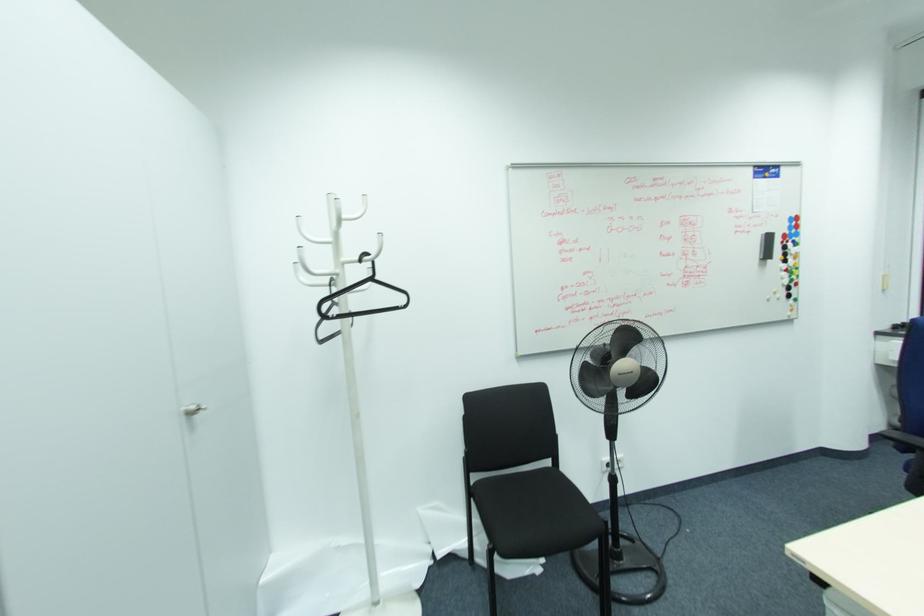
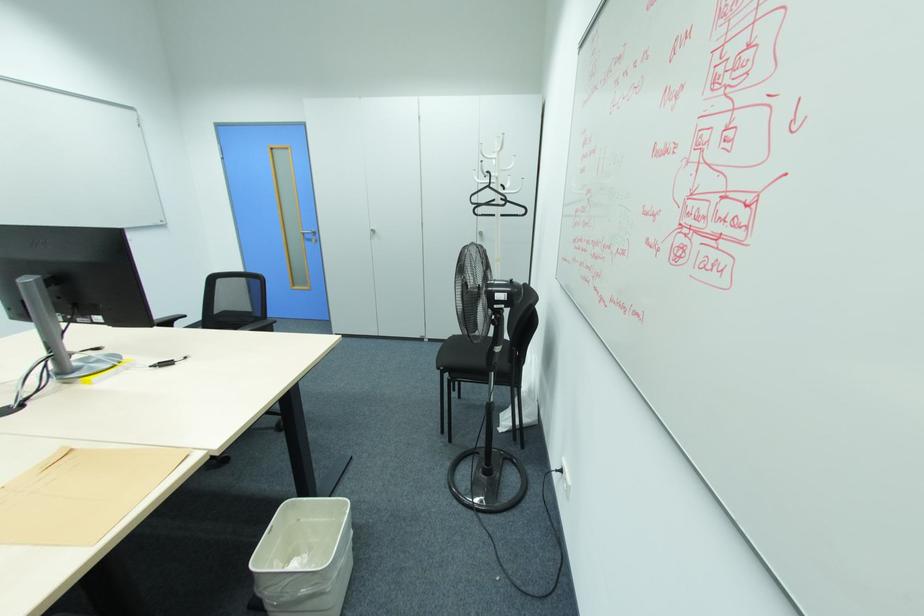
Where in the second image is the point corresponding to (377,278) from the first image?

(492, 185)